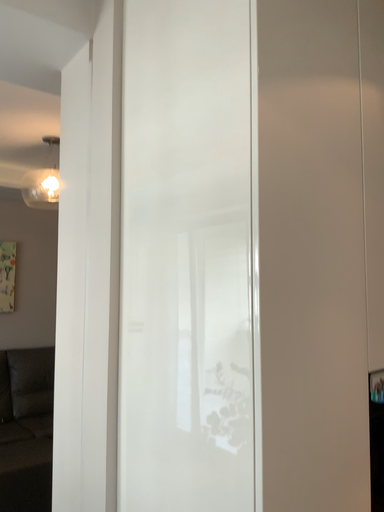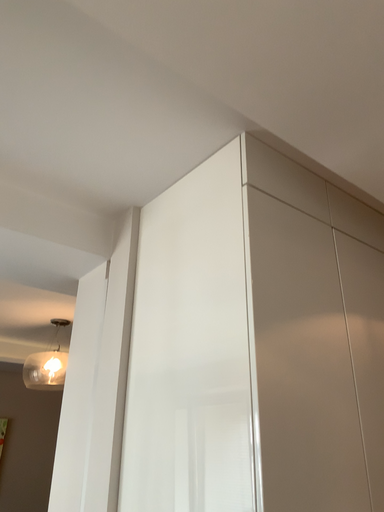
Question: How did the camera likely rotate when shooting the video?

Choices:
 (A) rotated upward
 (B) rotated downward

Answer: (A)